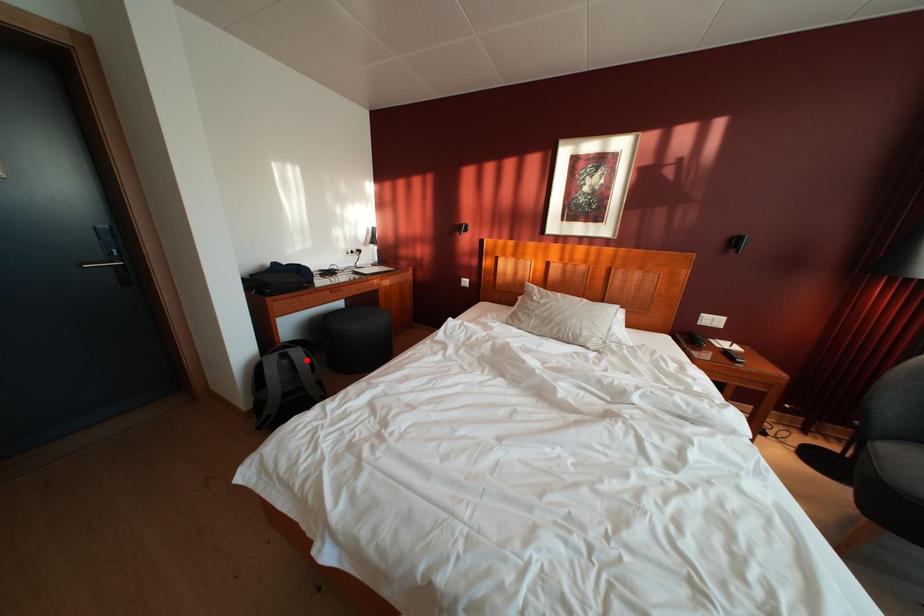
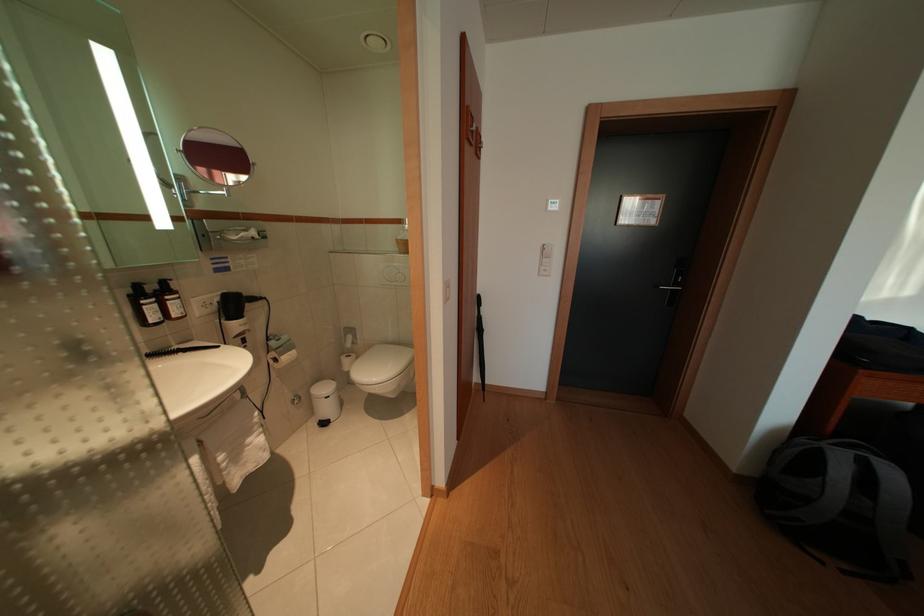
In the second image, find the point that corresponds to the highlighted location in the first image.

(901, 480)